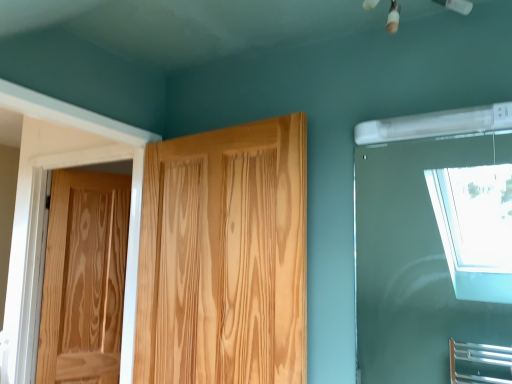
Question: From the image's perspective, is natural wood door at center, arranged as the second door when viewed from the back, beneath transparent glass window at upper right?

Choices:
 (A) yes
 (B) no

Answer: (A)

Question: Is natural wood door at center, the second door viewed from the left, at the left side of transparent glass window at upper right?

Choices:
 (A) yes
 (B) no

Answer: (A)

Question: Does natural wood door at center, placed as the first door when sorted from front to back, have a greater height compared to transparent glass window at upper right?

Choices:
 (A) no
 (B) yes

Answer: (B)

Question: Can you confirm if natural wood door at center, placed as the first door when sorted from front to back, is wider than transparent glass window at upper right?

Choices:
 (A) no
 (B) yes

Answer: (B)

Question: From the image's perspective, is natural wood door at center, arranged as the second door when viewed from the back, located above transparent glass window at upper right?

Choices:
 (A) yes
 (B) no

Answer: (B)

Question: Would you say natural wood door at center, placed as the first door when sorted from front to back, is to the left or to the right of transparent glass window at upper right in the picture?

Choices:
 (A) left
 (B) right

Answer: (A)

Question: Looking at the image, does natural wood door at center, the second door viewed from the left, seem bigger or smaller compared to transparent glass window at upper right?

Choices:
 (A) small
 (B) big

Answer: (B)

Question: From the image's perspective, is natural wood door at center, the second door viewed from the left, above or below transparent glass window at upper right?

Choices:
 (A) below
 (B) above

Answer: (A)

Question: From their relative heights in the image, would you say natural wood door at center, arranged as the second door when viewed from the back, is taller or shorter than transparent glass window at upper right?

Choices:
 (A) short
 (B) tall

Answer: (B)

Question: Is transparent glass window at upper right to the left or to the right of natural wood door at left, placed as the first door when sorted from back to front, in the image?

Choices:
 (A) right
 (B) left

Answer: (A)

Question: From a real-world perspective, relative to natural wood door at left, placed as the first door when sorted from left to right, is transparent glass window at upper right vertically above or below?

Choices:
 (A) above
 (B) below

Answer: (A)

Question: In terms of height, does transparent glass window at upper right look taller or shorter compared to natural wood door at left, placed as the first door when sorted from back to front?

Choices:
 (A) short
 (B) tall

Answer: (A)

Question: Looking at the image, does transparent glass window at upper right seem bigger or smaller compared to natural wood door at left, placed as the first door when sorted from back to front?

Choices:
 (A) big
 (B) small

Answer: (B)

Question: Looking at the image, does natural wood door at center, the second door viewed from the left, seem bigger or smaller compared to natural wood door at left, which is the 2th door in front-to-back order?

Choices:
 (A) big
 (B) small

Answer: (A)

Question: Is natural wood door at center, the second door viewed from the left, to the left or to the right of natural wood door at left, placed as the first door when sorted from left to right, in the image?

Choices:
 (A) right
 (B) left

Answer: (A)